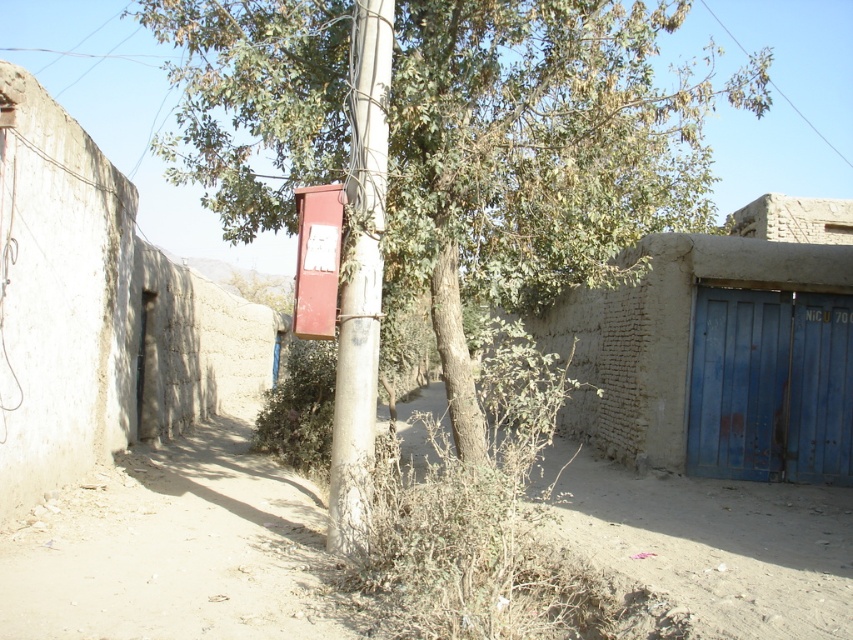
Question: Which object is the farthest from the blue mud hut at right?

Choices:
 (A) metallic red phone box at center
 (B) blue wooden door at right
 (C) green leafy tree at center
 (D) matte red mailbox at center

Answer: (D)

Question: Considering the relative positions of blue wooden door at right and concrete pole at center in the image provided, where is blue wooden door at right located with respect to concrete pole at center?

Choices:
 (A) below
 (B) above

Answer: (A)

Question: Which point is closer to the camera?

Choices:
 (A) (712, 294)
 (B) (334, 486)

Answer: (B)

Question: Based on their relative distances, which object is nearer to the blue wooden door at right?

Choices:
 (A) blue mud hut at right
 (B) green leafy tree at center

Answer: (A)

Question: Is matte red mailbox at center above blue mud hut at right?

Choices:
 (A) yes
 (B) no

Answer: (B)

Question: Is blue mud hut at right bigger than concrete pole at center?

Choices:
 (A) no
 (B) yes

Answer: (B)